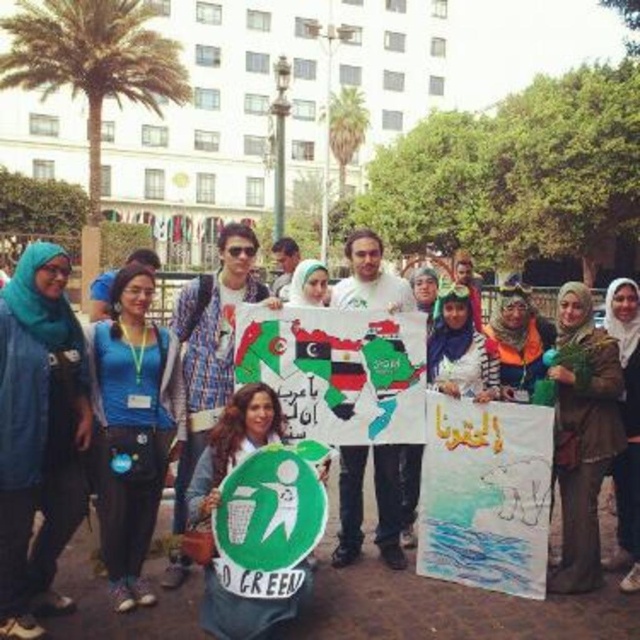
You are a photographer at the event and need to capture both the teal fabric hijab at center and the blue fabric shirt at left in a single photo. Which object should you focus on first to ensure both are in frame?

The teal fabric hijab at center has a lesser height compared to the blue fabric shirt at left, so you should focus on the blue fabric shirt at left first to ensure both are in frame.

You are a photographer taking a picture of the teal fabric hijab at center and the blue fabric shirt at left. Which object will appear closer to the camera in the photo?

The teal fabric hijab at center appears closer to the camera because it is in front of the blue fabric shirt at left.